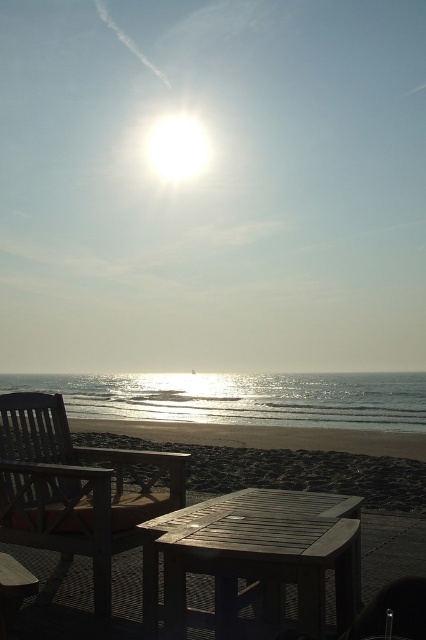
You are standing on the wooden patio and want to place a small umbrella between the wooden slats chair at lower left and the shiny metallic water at lower center. Which object will the umbrella be closer to after placing it midway between them?

The umbrella will be closer to the wooden slats chair at lower left because it is closer to the viewer than the shiny metallic water at lower center, so the midpoint between them would be nearer to the chair.

You are a beachgoer who wants to place a 30 inch long beach umbrella between the wooden slats chair at lower left and the wooden table at center. Can you fit it there without overlapping either object?

The distance between the wooden slats chair at lower left and the wooden table at center is 28.89 inches. Since the umbrella is 30 inches long, it would be too long to fit in the space between them without overlapping either object.